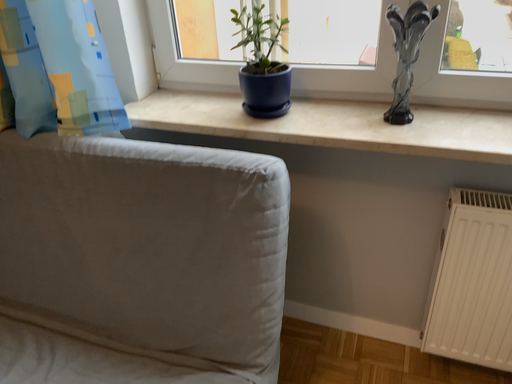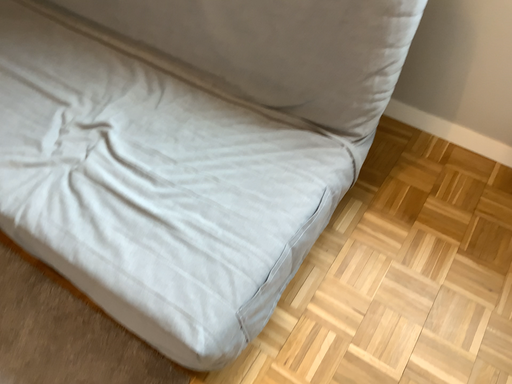
Question: Which way did the camera rotate in the video?

Choices:
 (A) rotated right
 (B) rotated left

Answer: (B)